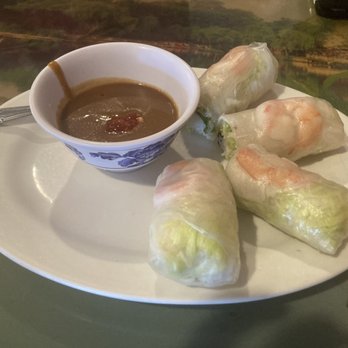
Locate an element on the screen. Image resolution: width=348 pixels, height=348 pixels. tabletop is located at coordinates (62, 314).